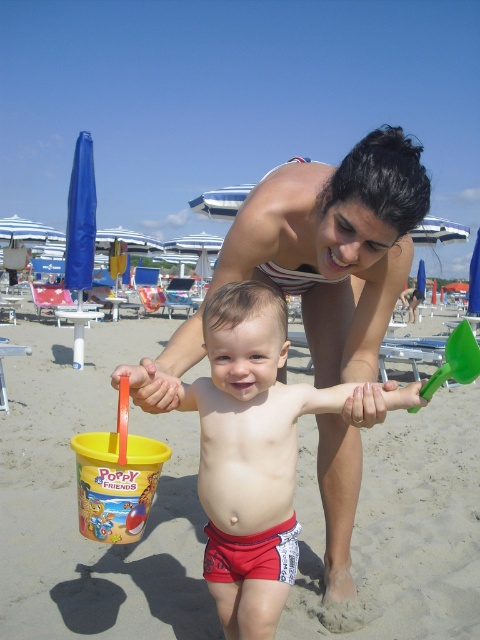
You are a lifeguard on duty and need to ensure all beachgoers are wearing appropriate swimwear. You notice two red items at the center of the image. Which item is wider? The smooth red shorts at center or the red cotton diaper at center?

The smooth red shorts at center might be wider than red cotton diaper at center according to the description.

A lifeguard needs to reach the child holding the yellow bucket labeled Poppy Friends and the green shovel as quickly as possible. The lifeguard is currently at the point marked at coordinates point (224, 344). If the lifeguard can move at 3 meters per second, how many seconds will it take to reach the child?

The distance between the point (224, 344) and the child is 1.56 meters. At a speed of 3 meters per second, the lifeguard will take 1.56 divided by 3, which equals 0.52 seconds to reach the child.